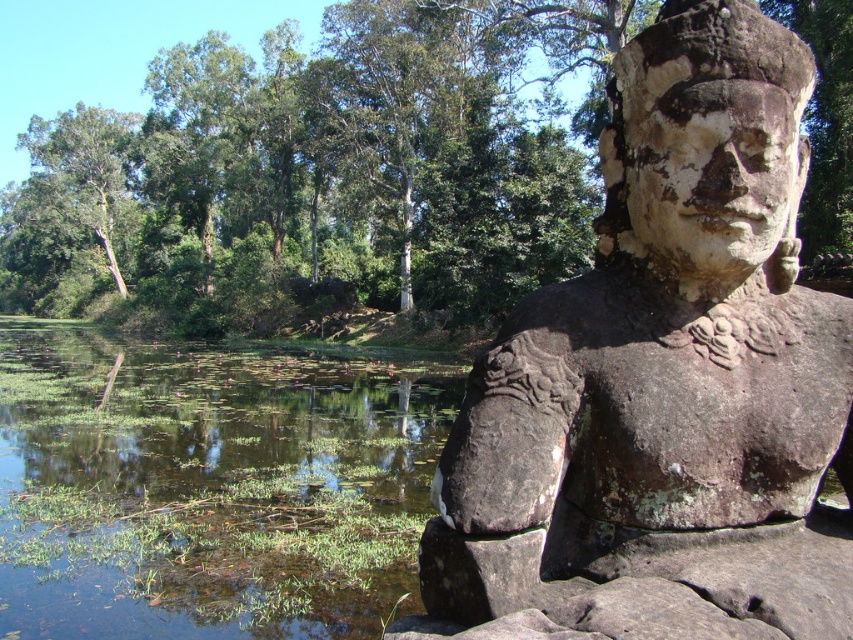
Between green grassy river at lower left and green leafy tree at upper left, which one appears on the left side from the viewer's perspective?

green leafy tree at upper left

Does point (96, 385) come in front of point (45, 132)?

Yes, point (96, 385) is in front of point (45, 132).

Is point (80, 433) behind point (44, 170)?

No, (80, 433) is closer to viewer.

Where is `green grassy river at lower left`? green grassy river at lower left is located at coordinates (207, 486).

Is weathered stone statue at right shorter than green grassy river at lower left?

Yes, weathered stone statue at right is shorter than green grassy river at lower left.

Who is more forward, [820,314] or [283,481]?

Positioned in front is point [820,314].

This screenshot has height=640, width=853. Describe the element at coordinates (663, 380) in the screenshot. I see `weathered stone statue at right` at that location.

In order to click on weathered stone statue at right in this screenshot , I will do `click(663, 380)`.

Who is shorter, green leafy tree at upper center or green leafy tree at upper left?

With less height is green leafy tree at upper center.

Where is `green leafy tree at upper center`? The image size is (853, 640). green leafy tree at upper center is located at coordinates (318, 172).

Find the location of a particular element. green leafy tree at upper center is located at coordinates [318, 172].